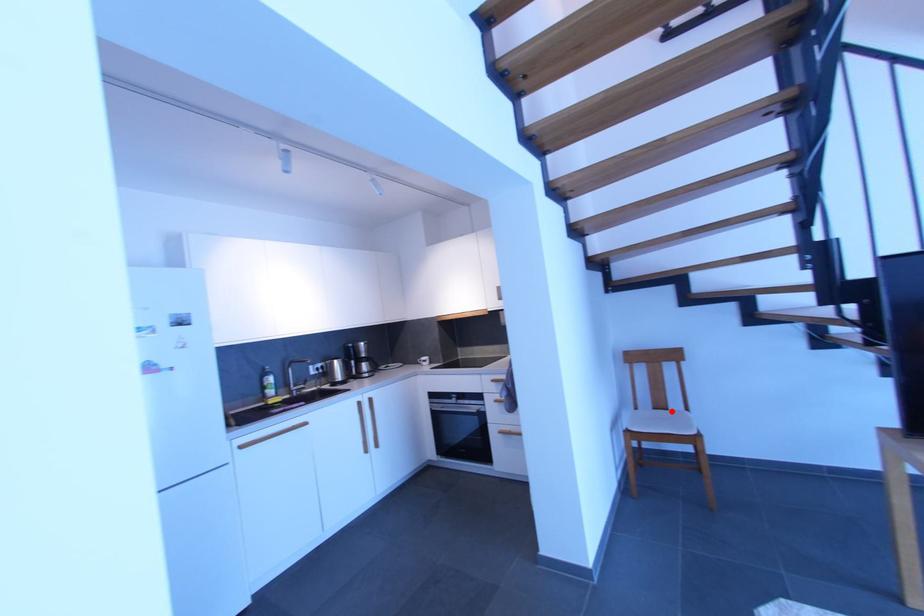
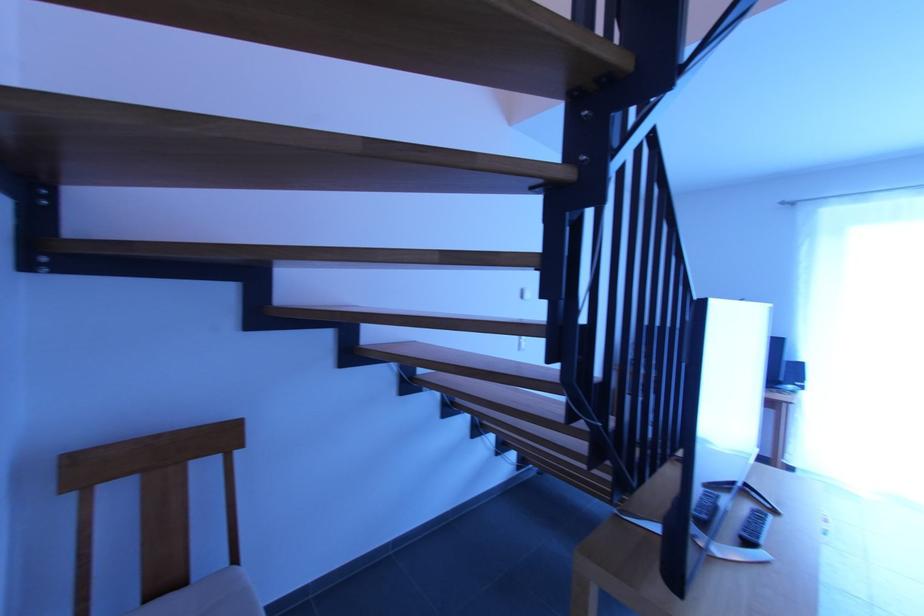
Question: I am providing you with two images of the same scene from different viewpoints. A red point is marked on the first image. Is the red point's position out of view in image 2?

Choices:
 (A) Yes
 (B) No

Answer: (B)